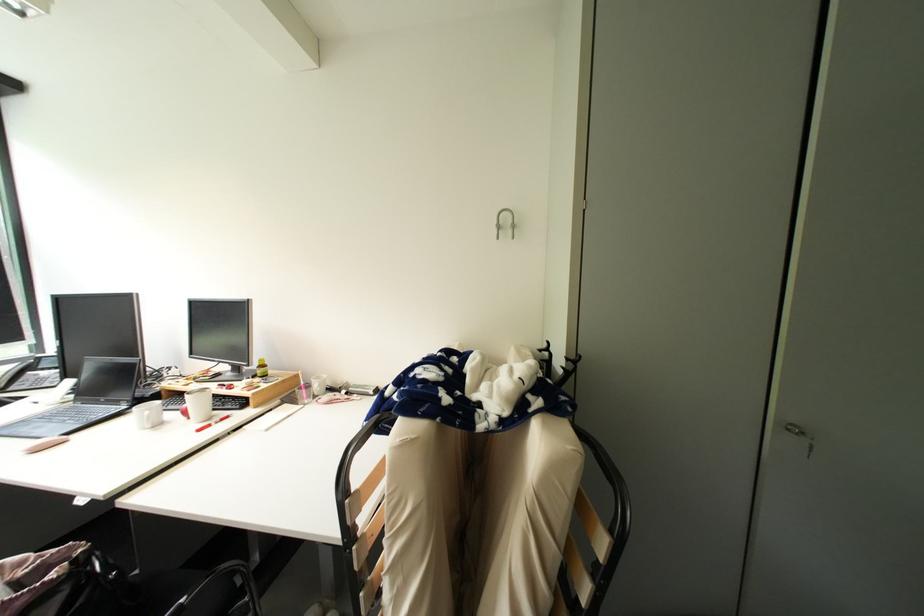
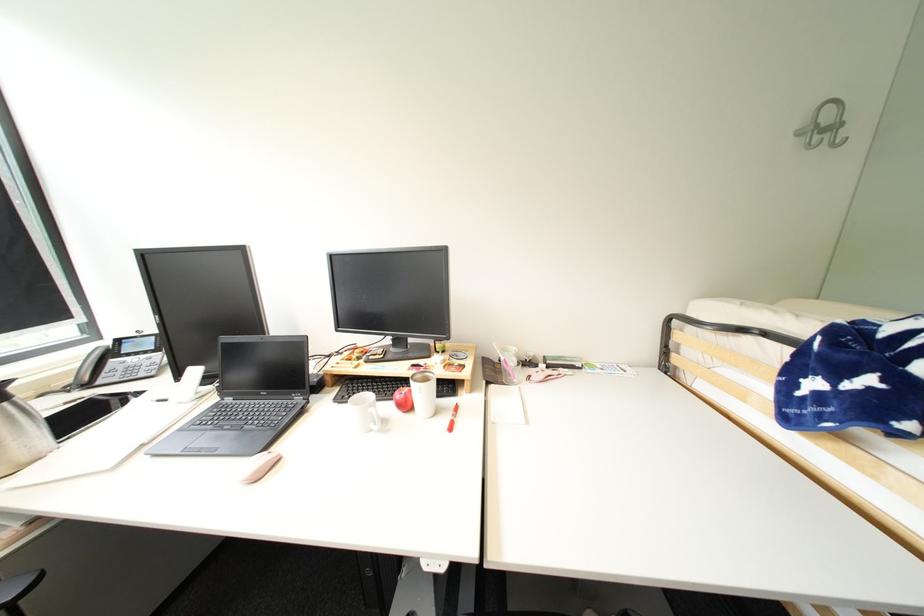
Where in the second image is the point corresponding to point (520, 227) from the first image?

(841, 128)